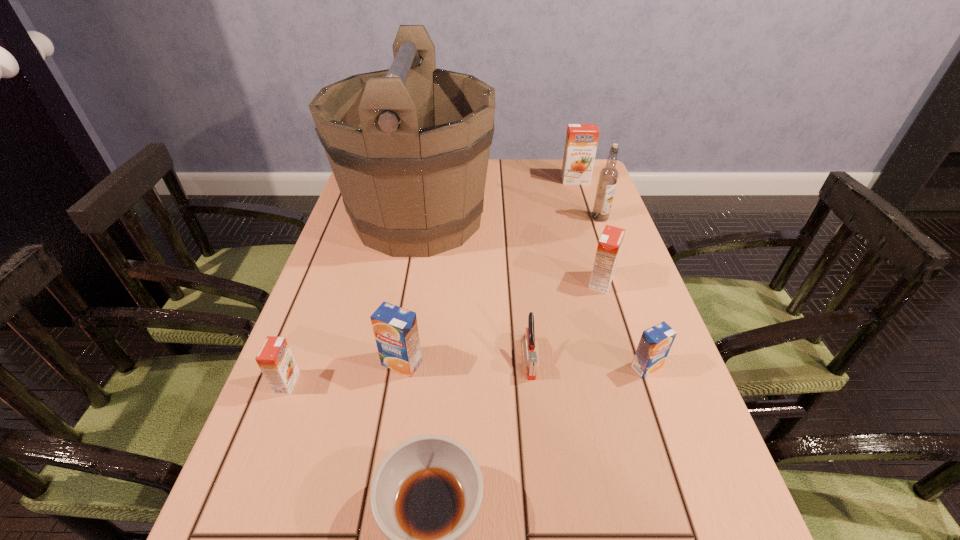
Find the location of a particular element. This screenshot has height=540, width=960. the leftmost orange orange juice is located at coordinates (275, 359).

Identify the location of the fifth object from left to right. (529, 336).

This screenshot has width=960, height=540. I want to click on stapler, so click(x=529, y=336).

At what (x,y) coordinates should I click in order to perform the action: click on free space located 0.290m on the front of the bucket. Please return your answer as a coordinate pair (x, y). Looking at the image, I should click on (393, 362).

This screenshot has height=540, width=960. In order to click on blank space located 0.400m on the label of the eighth shortest object in this screenshot , I will do `click(638, 326)`.

You are a GUI agent. You are given a task and a screenshot of the screen. Output one action in this format:
    pyautogui.click(x=<x>, y=<y>)
    Task: Click on the free point located 0.320m on the front of the seventh shortest object
    
    Given the screenshot: What is the action you would take?
    pyautogui.click(x=596, y=245)

Where is `free space located 0.240m on the back of the second farthest orange orange juice`? free space located 0.240m on the back of the second farthest orange orange juice is located at coordinates (582, 218).

Locate an element on the screen. vacant space located 0.240m on the right of the fourth orange juice from right to left is located at coordinates (539, 363).

Locate an element on the screen. This screenshot has width=960, height=540. vacant space situated on the front of the smaller blue orange_juice is located at coordinates (681, 468).

At what (x,y) coordinates should I click in order to perform the action: click on free space located 0.180m on the right of the leftmost orange orange juice. Please return your answer as a coordinate pair (x, y). This screenshot has width=960, height=540. Looking at the image, I should click on pyautogui.click(x=387, y=383).